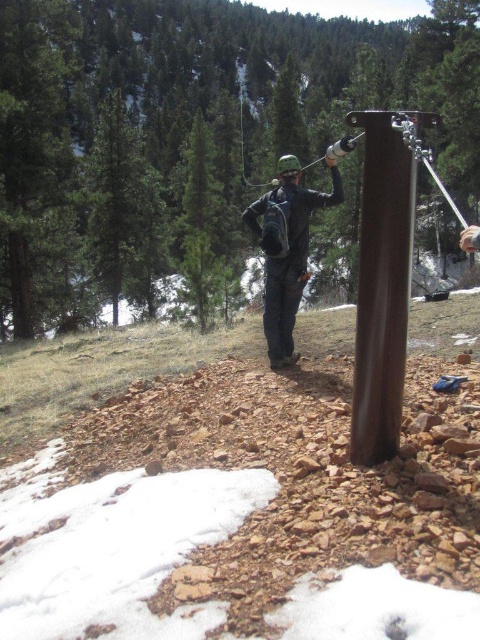
Describe the element at coordinates (382, 284) in the screenshot. I see `brown metallic post at center` at that location.

At what (x,y) coordinates should I click in order to perform the action: click on brown metallic post at center. Please return your answer as a coordinate pair (x, y). The image size is (480, 640). Looking at the image, I should click on (382, 284).

Describe the element at coordinates (382, 284) in the screenshot. This screenshot has width=480, height=640. I see `brown metallic post at center` at that location.

This screenshot has height=640, width=480. I want to click on brown metallic post at center, so click(382, 284).

Can you confirm if brown metallic post at center is positioned above matte black backpack at center?

No.

At what (x,y) coordinates should I click in order to perform the action: click on brown metallic post at center. Please return your answer as a coordinate pair (x, y). The image size is (480, 640). Looking at the image, I should click on (382, 284).

Based on the photo, can you confirm if matte black backpack at center is bigger than metallic silver ski pole at upper center?

No, matte black backpack at center is not bigger than metallic silver ski pole at upper center.

Identify the location of matte black backpack at center. The image size is (480, 640). (287, 250).